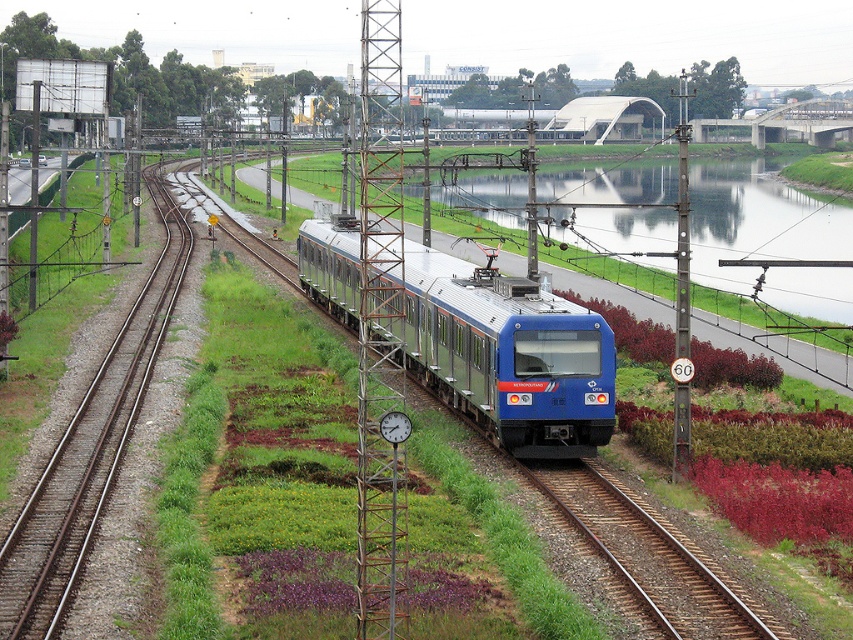
You are a passenger on the blue metallic train at center and want to see the reflective glass waterway at center. Which direction should you look to see it?

The reflective glass waterway at center is positioned on the right side of the blue metallic train at center, so you should look to your right to see it.

You are a passenger on the blue metallic train at center. You look out the window and see the reflective glass waterway at center. Is the waterway above or below the train?

The reflective glass waterway at center is located above the blue metallic train at center, so the waterway is above the train.